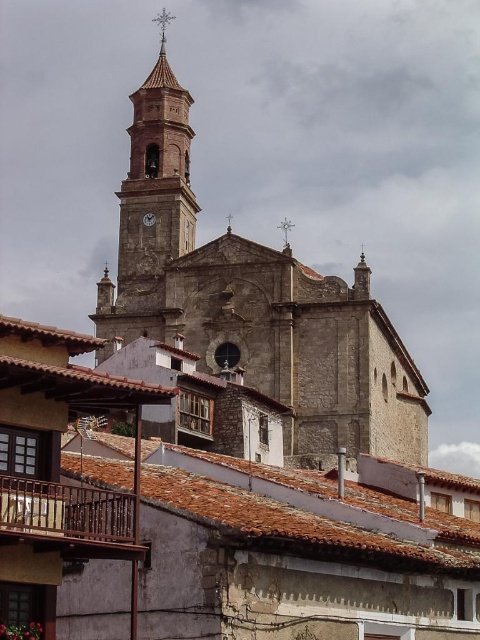
Question: Among these points, which one is farthest from the camera?

Choices:
 (A) (290, 228)
 (B) (151, 216)
 (C) (152, 163)

Answer: (A)

Question: Which point is closer to the camera taking this photo?

Choices:
 (A) (286, 243)
 (B) (344, 412)

Answer: (B)

Question: Does stone church at center have a greater width compared to silver metallic spire at upper center?

Choices:
 (A) no
 (B) yes

Answer: (B)

Question: Does silver metallic spire at upper center have a greater width compared to metallic clock at center?

Choices:
 (A) no
 (B) yes

Answer: (B)

Question: Which object is positioned farthest from the silver metallic spire at upper center?

Choices:
 (A) stone church at center
 (B) metallic clock at center

Answer: (B)

Question: Does stone church at center appear on the left side of metallic clock at center?

Choices:
 (A) yes
 (B) no

Answer: (B)